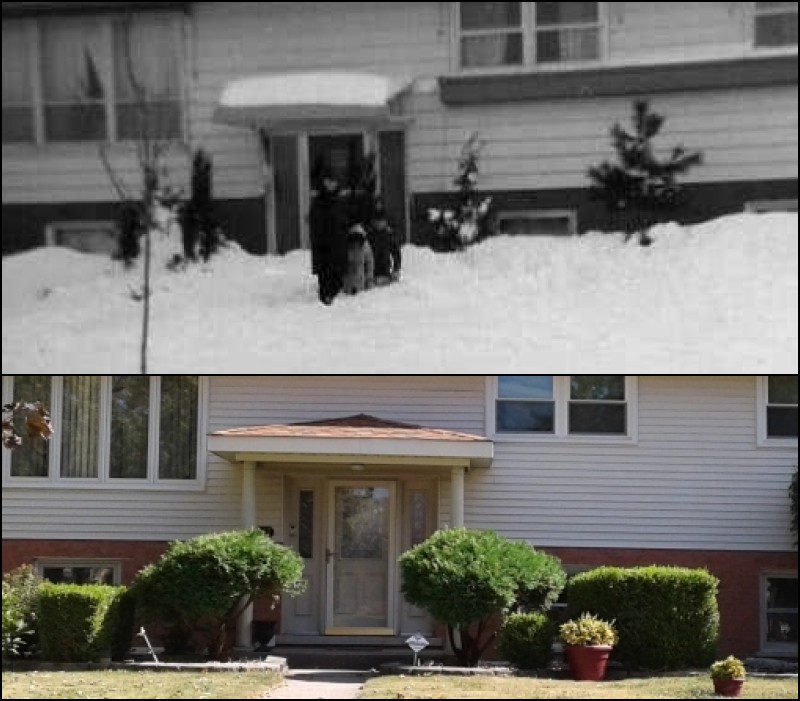
Locate an element on the screen. The height and width of the screenshot is (701, 800). porch light fixture is located at coordinates (x=362, y=469).